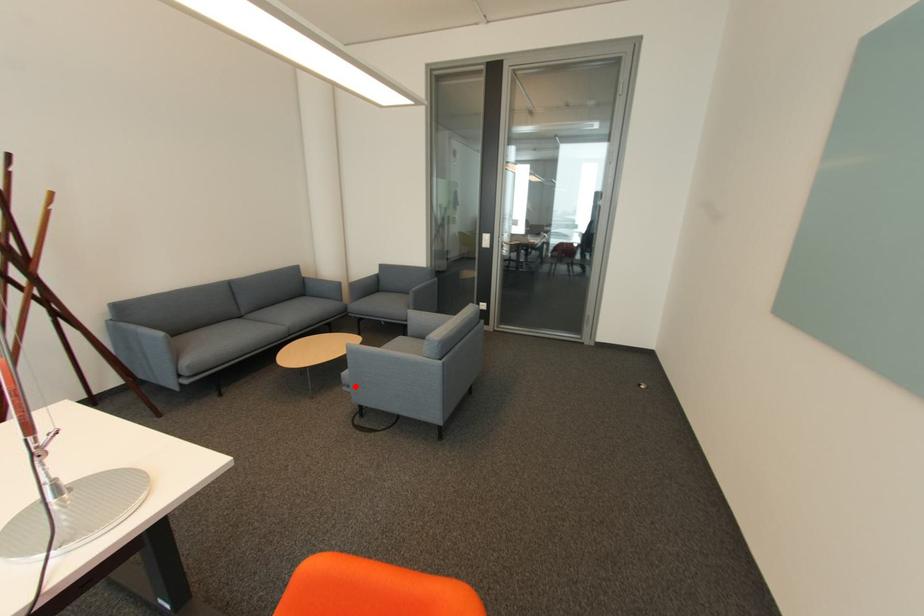
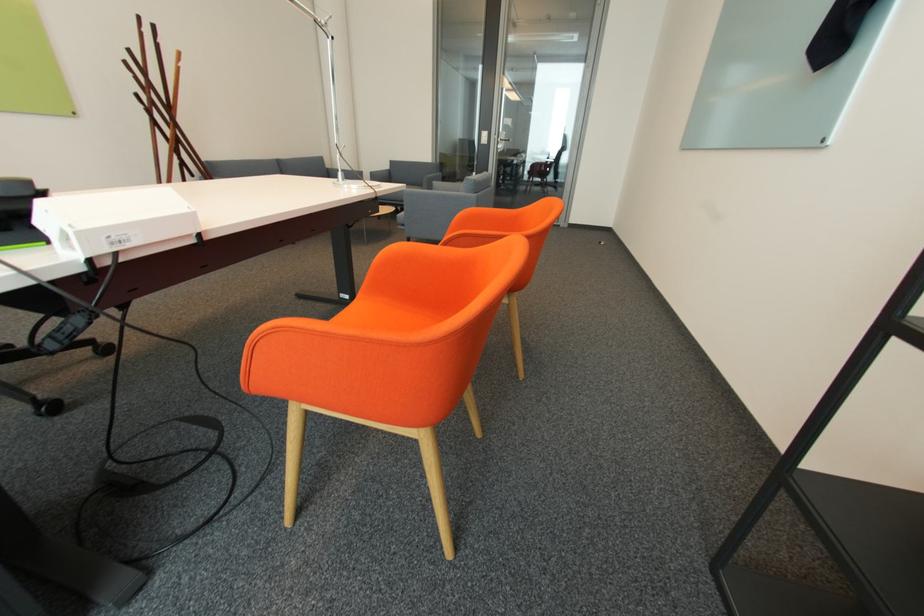
Locate, in the second image, the point that corresponds to the highlighted location in the first image.

(408, 225)